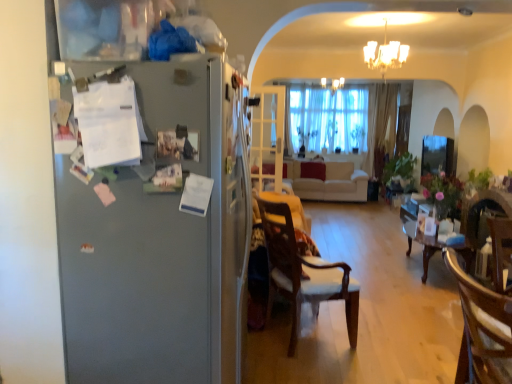
This screenshot has height=384, width=512. I want to click on free point below white glass chandelier at upper center, the first light fixture in the bottom-to-top sequence (from a real-world perspective), so click(369, 259).